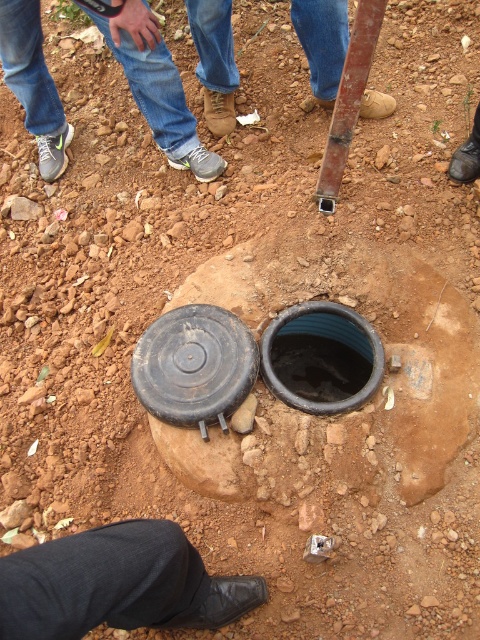
You are standing at the well opening and want to place a small flag at point (60, 608) and another flag at point (202, 36). Which flag will appear closer to you when viewed from your current position?

The flag placed at point (60, 608) will appear closer to you because it is closer to the camera than point (202, 36).